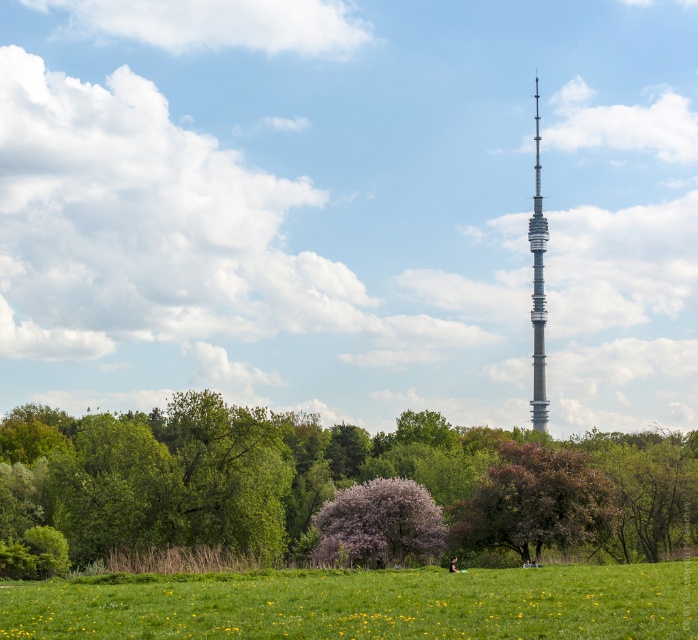
You are standing in the field and want to reach both points. Which point, point (x=544, y=529) or point (x=350, y=538), is closer to you?

Point (x=544, y=529) is closer to the camera than point (x=350, y=538), so it is closer to you.

You are standing in the field and want to take a photo of the gray metallic tower at center without the green leafy tree at center blocking the view. Which direction should you move to ensure the tower is visible without the tree in front?

Move away from the green leafy tree at center towards the direction of the gray metallic tower at center. Since the green leafy tree at center is closer to you, moving towards the tower will put the tree behind you, allowing the tower to be visible without obstruction.